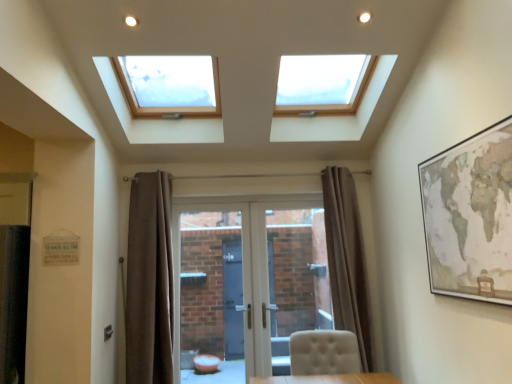
Question: Is brown fabric curtain at center, positioned as the second curtain in left-to-right order, not inside white glossy door at center?

Choices:
 (A) yes
 (B) no

Answer: (A)

Question: Is brown fabric curtain at center, arranged as the 1th curtain when viewed from the right, turned away from white glossy door at center?

Choices:
 (A) no
 (B) yes

Answer: (A)

Question: From a real-world perspective, is brown fabric curtain at center, positioned as the second curtain in left-to-right order, under white glossy door at center?

Choices:
 (A) no
 (B) yes

Answer: (A)

Question: Can you confirm if brown fabric curtain at center, positioned as the second curtain in left-to-right order, is smaller than white glossy door at center?

Choices:
 (A) yes
 (B) no

Answer: (A)

Question: Does brown fabric curtain at center, arranged as the 1th curtain when viewed from the right, have a greater height compared to white glossy door at center?

Choices:
 (A) yes
 (B) no

Answer: (A)

Question: Considering the relative positions of brown fabric curtain at left, the 1th curtain viewed from the left, and white glossy door at center in the image provided, is brown fabric curtain at left, the 1th curtain viewed from the left, to the left or to the right of white glossy door at center?

Choices:
 (A) left
 (B) right

Answer: (A)

Question: Is point (156, 236) positioned closer to the camera than point (194, 271)?

Choices:
 (A) farther
 (B) closer

Answer: (B)

Question: Relative to white glossy door at center, is brown fabric curtain at left, the second curtain when ordered from right to left, in front or behind?

Choices:
 (A) front
 (B) behind

Answer: (A)

Question: Looking at the image, does brown fabric curtain at left, the second curtain when ordered from right to left, seem bigger or smaller compared to white glossy door at center?

Choices:
 (A) small
 (B) big

Answer: (A)

Question: Considering the positions of white tufted chair at lower center and white glossy door at center in the image, is white tufted chair at lower center taller or shorter than white glossy door at center?

Choices:
 (A) short
 (B) tall

Answer: (A)

Question: Do you think white tufted chair at lower center is within white glossy door at center, or outside of it?

Choices:
 (A) outside
 (B) inside

Answer: (A)

Question: Based on their positions, is white tufted chair at lower center located to the left or right of white glossy door at center?

Choices:
 (A) left
 (B) right

Answer: (B)

Question: From a real-world perspective, is white tufted chair at lower center positioned above or below white glossy door at center?

Choices:
 (A) above
 (B) below

Answer: (B)

Question: Is point (151, 220) positioned closer to the camera than point (349, 228)?

Choices:
 (A) closer
 (B) farther

Answer: (A)

Question: Is brown fabric curtain at left, the second curtain when ordered from right to left, in front of or behind brown fabric curtain at center, arranged as the 1th curtain when viewed from the right, in the image?

Choices:
 (A) behind
 (B) front

Answer: (B)